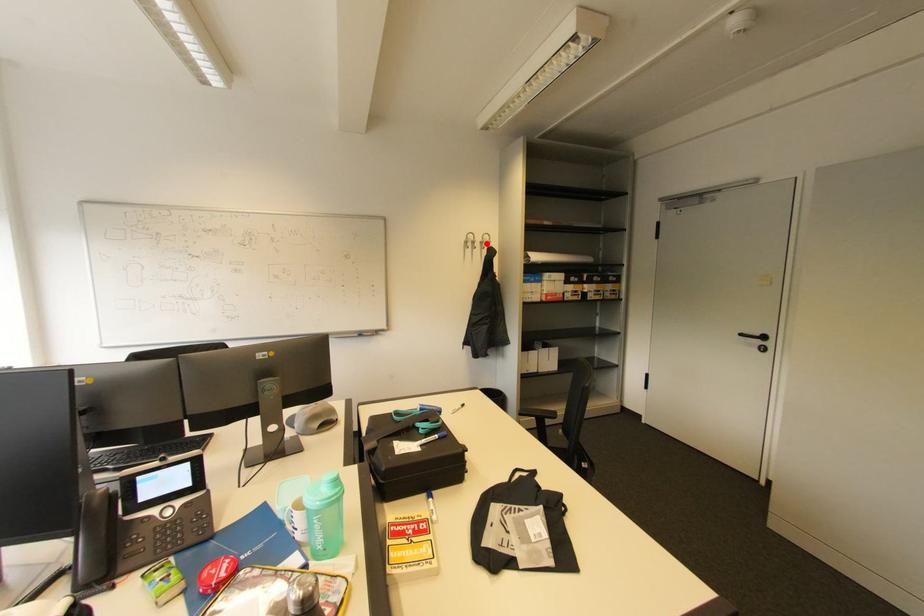
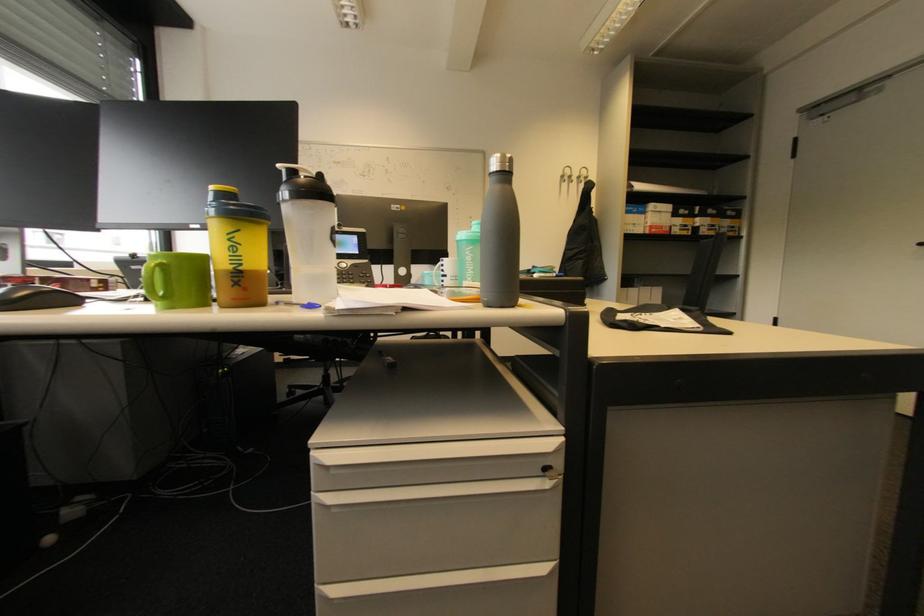
The point at the highlighted location is marked in the first image. Where is the corresponding point in the second image?

(584, 177)